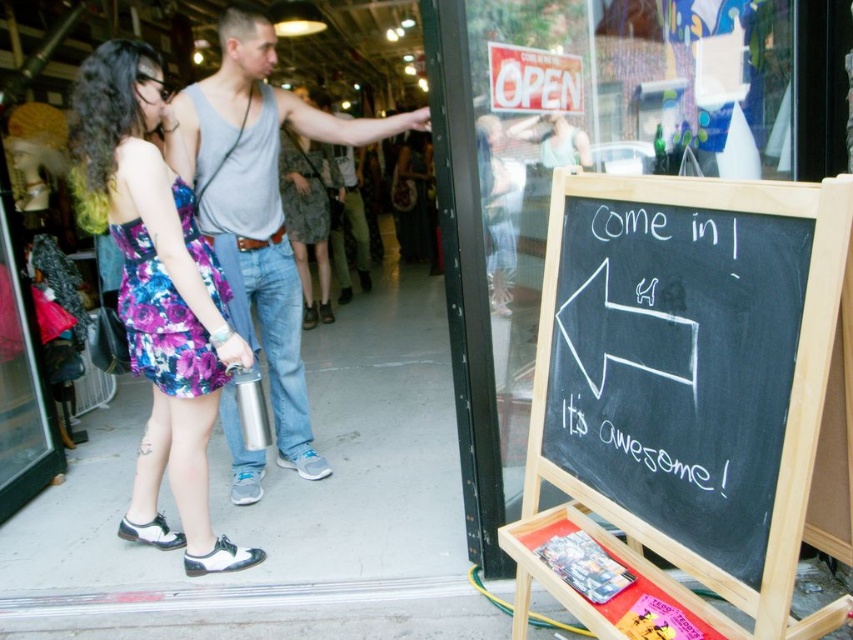
Is point (665, 253) positioned before point (190, 465)?

That is True.

Who is shorter, black chalkboard at lower right or floral fabric dress at center?

Standing shorter between the two is black chalkboard at lower right.

Which is behind, point (734, 371) or point (184, 492)?

Point (184, 492)

You are a GUI agent. You are given a task and a screenshot of the screen. Output one action in this format:
    pyautogui.click(x=<x>, y=<y>)
    Task: Click on the black chalkboard at lower right
    This screenshot has height=640, width=853.
    Given the screenshot: What is the action you would take?
    pyautogui.click(x=683, y=392)

Is black chalkboard at lower right wider than gray tank top at center?

Incorrect, black chalkboard at lower right's width does not surpass gray tank top at center's.

Who is lower down, black chalkboard at lower right or gray tank top at center?

black chalkboard at lower right is below.

What do you see at coordinates (683, 392) in the screenshot?
I see `black chalkboard at lower right` at bounding box center [683, 392].

Locate an element on the screen. The image size is (853, 640). black chalkboard at lower right is located at coordinates [683, 392].

Is floral fabric dress at center to the left of gray tank top at center from the viewer's perspective?

Yes, floral fabric dress at center is to the left of gray tank top at center.

Can you confirm if floral fabric dress at center is wider than gray tank top at center?

No.

Does point (213, 262) come behind point (190, 141)?

No, (213, 262) is in front of (190, 141).

Where is `floral fabric dress at center`? This screenshot has width=853, height=640. floral fabric dress at center is located at coordinates tap(158, 296).